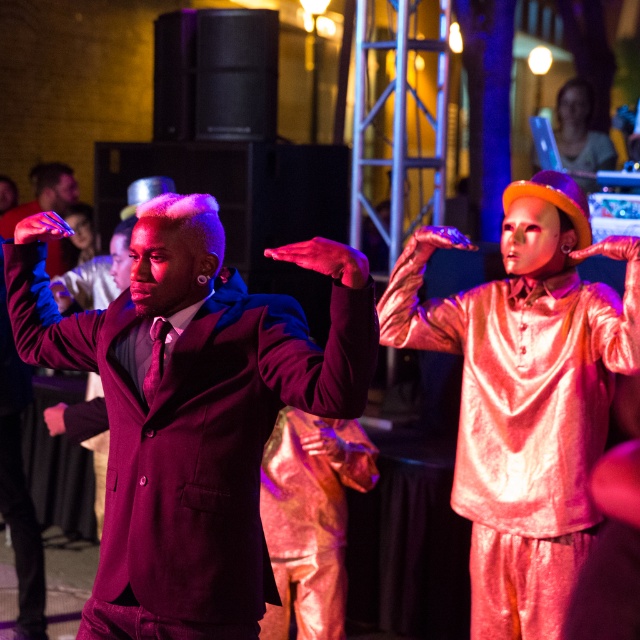
You are directing a movie scene and need to place a spotlight on the point that is closer to the camera. Which point should you choose between point A at (364, 388) and point B at (586, 131)?

Point A at (364, 388) is in front of point B at (586, 131), so you should choose point A at (364, 388) for the spotlight since it is closer to the camera.

You are a photographer at this event and want to capture a photo where the matte black suit at center and the smooth skin face at upper right are both visible. Based on their positions, which object should you position closer to the left side of the frame?

The matte black suit at center should be positioned closer to the left side of the frame since it is located to the left of the smooth skin face at upper right.

You are a photographer at the event and want to capture a photo that includes both the shiny purple suit at center and the smooth skin face at upper right. Based on their positions, which object should you focus on first to ensure both are in frame?

The shiny purple suit at center is positioned on the left side of smooth skin face at upper right, so you should focus on the shiny purple suit at center first to ensure both are in frame.